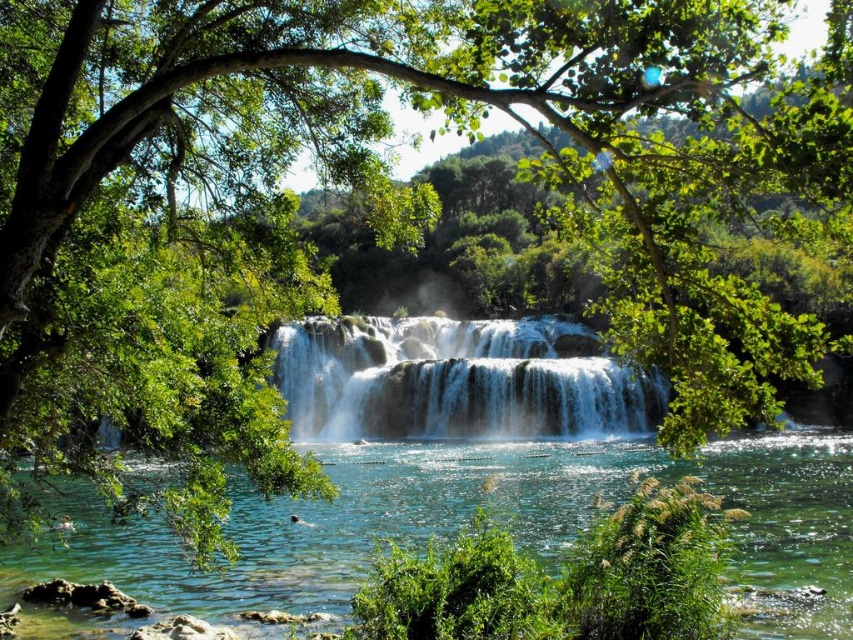
Question: Considering the relative positions of clear blue water at center and white frothy water at center in the image provided, where is clear blue water at center located with respect to white frothy water at center?

Choices:
 (A) below
 (B) above

Answer: (A)

Question: Does clear blue water at center have a larger size compared to white frothy water at center?

Choices:
 (A) yes
 (B) no

Answer: (B)

Question: Which point is closer to the camera?

Choices:
 (A) (822, 576)
 (B) (602, 360)

Answer: (A)

Question: Which point is farther to the camera?

Choices:
 (A) white frothy water at center
 (B) clear blue water at center

Answer: (A)

Question: Does clear blue water at center have a larger size compared to white frothy water at center?

Choices:
 (A) yes
 (B) no

Answer: (B)